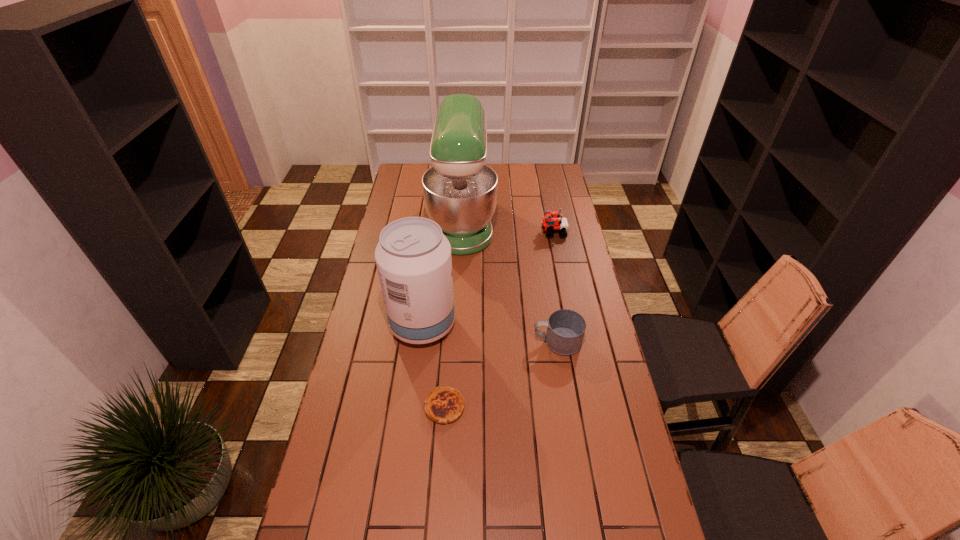
Locate an element on the screen. The height and width of the screenshot is (540, 960). vacant space at the right edge is located at coordinates (565, 294).

Image resolution: width=960 pixels, height=540 pixels. I want to click on free space at the far left corner of the desktop, so click(409, 179).

This screenshot has height=540, width=960. What are the coordinates of `vacant area between the mug and the nearest object` in the screenshot? It's located at (501, 374).

Find the location of a particular element. The width and height of the screenshot is (960, 540). free spot between the alcohol and the Lego is located at coordinates (488, 279).

Where is `free area in between the alcohol and the quiche`? The height and width of the screenshot is (540, 960). free area in between the alcohol and the quiche is located at coordinates (434, 366).

Where is `vacant area that lies between the fourth shortest object and the fourth tallest object`? This screenshot has width=960, height=540. vacant area that lies between the fourth shortest object and the fourth tallest object is located at coordinates (490, 333).

Identify the location of vacant space that's between the Lego and the quiche. This screenshot has height=540, width=960. (499, 320).

Locate an element on the screen. free space that is in between the Lego and the shortest object is located at coordinates (499, 320).

This screenshot has height=540, width=960. What are the coordinates of `object that ranks as the second closest to the tallest object` in the screenshot? It's located at [x=413, y=257].

This screenshot has height=540, width=960. In order to click on the fourth closest object relative to the Lego in this screenshot , I will do `click(444, 405)`.